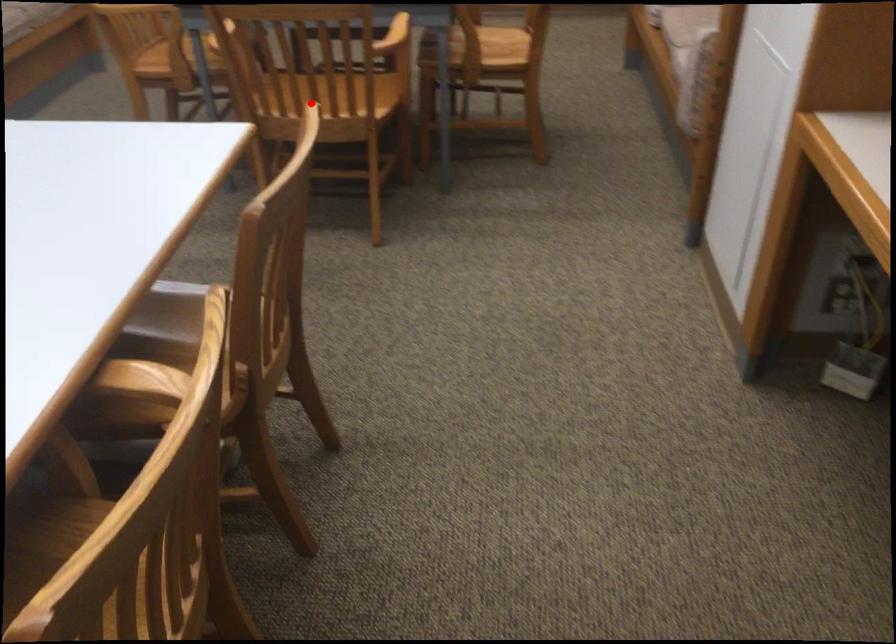
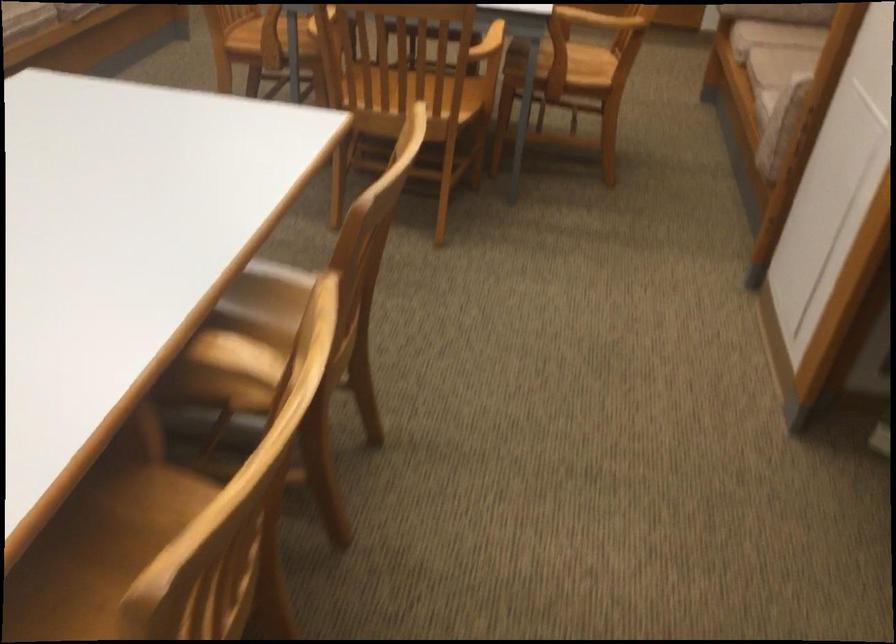
In the second image, find the point that corresponds to the highlighted location in the first image.

(419, 104)